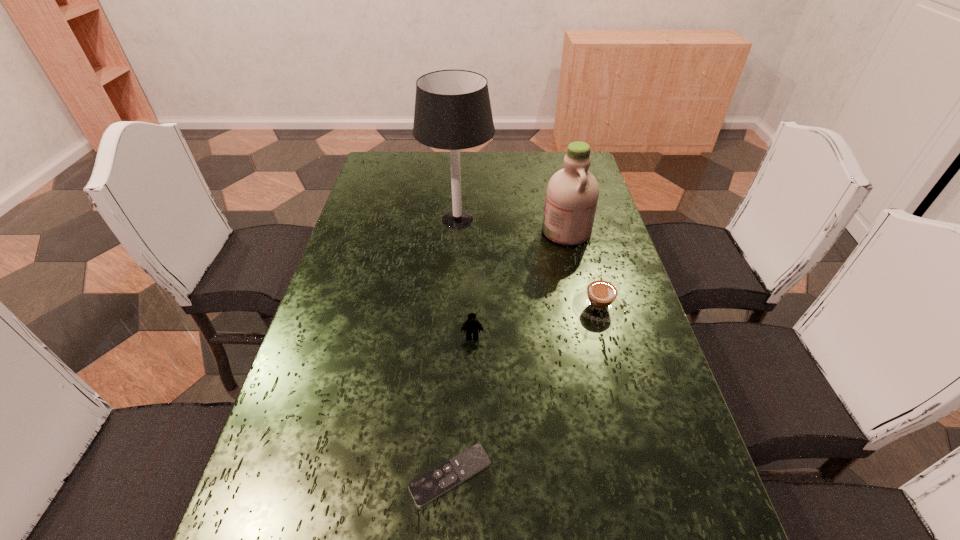
This screenshot has height=540, width=960. I want to click on table lamp, so click(453, 111).

The height and width of the screenshot is (540, 960). Find the location of `cleansing agent`. cleansing agent is located at coordinates (572, 193).

Find the location of a particular element. Lego is located at coordinates (471, 325).

Image resolution: width=960 pixels, height=540 pixels. Find the location of `the third nearest object`. the third nearest object is located at coordinates (599, 300).

You are a GUI agent. You are given a task and a screenshot of the screen. Output one action in this format:
    pyautogui.click(x=<x>, y=<y>)
    Task: Click on the shortest object
    
    Given the screenshot: What is the action you would take?
    pyautogui.click(x=429, y=486)

Identify the location of the nearest object. This screenshot has width=960, height=540. tap(429, 486).

Locate an element on the screen. The width and height of the screenshot is (960, 540). free space located 0.210m on the front of the tallest object is located at coordinates (453, 290).

At what (x,y) coordinates should I click in order to perform the action: click on vacant space located 0.350m on the front label of the fourth shortest object. Please return your answer as a coordinate pair (x, y). Looking at the image, I should click on (430, 231).

Find the location of a particular element. This screenshot has height=540, width=960. blank area located on the front label of the fourth shortest object is located at coordinates (484, 231).

Locate an element on the screen. The height and width of the screenshot is (540, 960). vacant space located on the front label of the fourth shortest object is located at coordinates (436, 231).